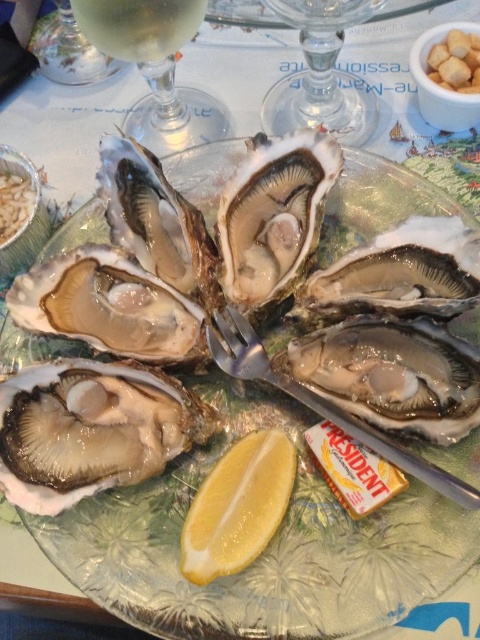
From the picture: Is transparent glass at upper center to the left of matte glass oyster at center from the viewer's perspective?

Incorrect, transparent glass at upper center is not on the left side of matte glass oyster at center.

Which is behind, point (263, 102) or point (3, 220)?

Point (263, 102)

Where is `transparent glass at upper center`? This screenshot has width=480, height=640. transparent glass at upper center is located at coordinates (322, 74).

The width and height of the screenshot is (480, 640). I want to click on transparent glass at upper center, so click(x=322, y=74).

Can you confirm if shiny silver oyster at center is thinner than yellow matte lemon at center?

In fact, shiny silver oyster at center might be wider than yellow matte lemon at center.

Which of these two, shiny silver oyster at center or yellow matte lemon at center, stands shorter?

Standing shorter between the two is yellow matte lemon at center.

Does point (39, 298) come behind point (214, 529)?

Yes, point (39, 298) is behind point (214, 529).

Where is `shiny silver oyster at center`? shiny silver oyster at center is located at coordinates (182, 250).

Between point (454, 52) and point (1, 224), which one is positioned behind?

Point (454, 52)

Measure the distance between white creamy croutons at upper right and matte glass oyster at center.

They are 17.50 inches apart.

Does point (460, 58) come closer to viewer compared to point (19, 218)?

No, (460, 58) is further to viewer.

Locate an element on the screen. The width and height of the screenshot is (480, 640). white creamy croutons at upper right is located at coordinates (456, 61).